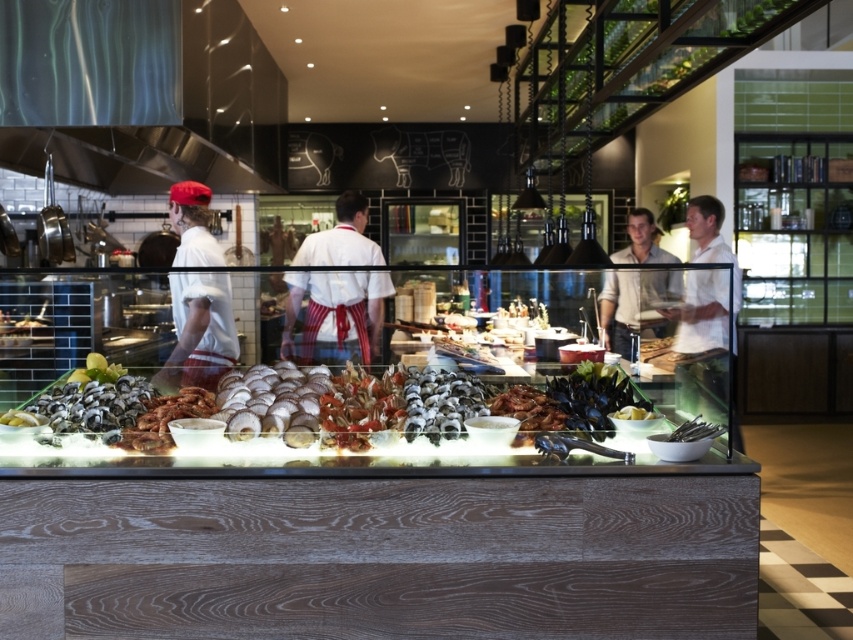
You are a customer at the buffet and want to take a photo of the shiny silver seafood at center. The restaurant has a rule that you must stay behind a yellow line marked at point 0.5 on the x and y axes. Can you take the photo without crossing the line?

The shiny silver seafood at center is located at point (318, 406), which is beyond the yellow line at 0.5 on both axes. Therefore, you cannot take the photo without crossing the line.

You are a guest at the buffet and want to take a photo of the shiny silver seafood at center and the matte white shirt at left. Which object should you focus on first if you want to capture both in the same frame without moving your camera?

The shiny silver seafood at center is to the right of the matte white shirt at left, so you should focus on the matte white shirt at left first to ensure both are within the frame.

You are a customer at the seafood buffet and want to choose between the two chefs based on their clothing. The chef with the white striped apron at center is closer to the clams, while the chef with the white linen shirt at right is farther away. Which chef can you reach faster if you start from the entrance?

The chef with the white striped apron at center can be reached faster since they are closer to the entrance compared to the chef with the white linen shirt at right who is farther away. However, the question mentions the white linen shirt at right is farther away from the clams, not necessarily the entrance. The spatial relationship between the entrance and the chefs isn